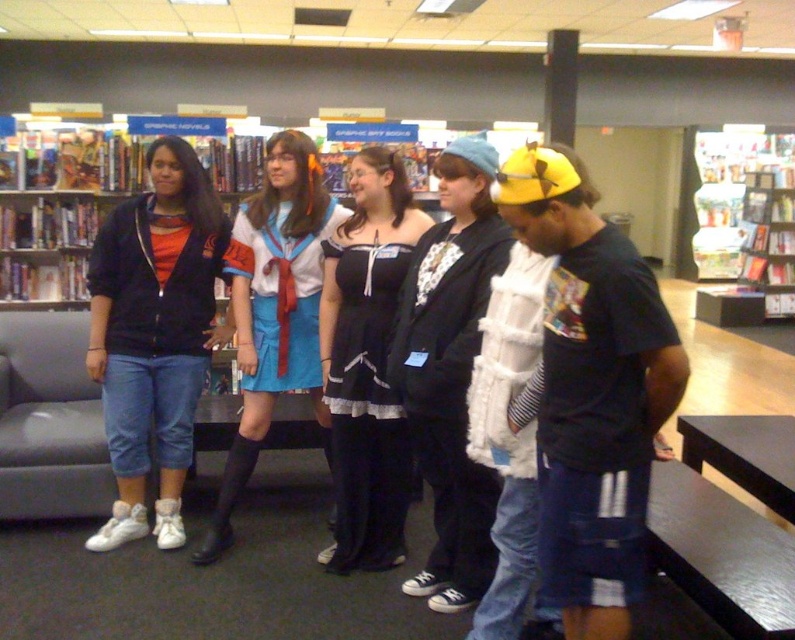
You are standing in the bookstore and want to determine which of the two points, point (157, 164) or point (751, 282), is closer to you. Based on the scene, which point is nearer?

Point (157, 164) is closer to the viewer than point (751, 282).

You are organizing a photoshoot and need to arrange the matte black jacket at left and the black lace dress at center based on their sizes. Which one should you place first in a display to emphasize size contrast?

The matte black jacket at left should be placed first because it is smaller in size compared to the black lace dress at center, creating a size contrast when displayed together.